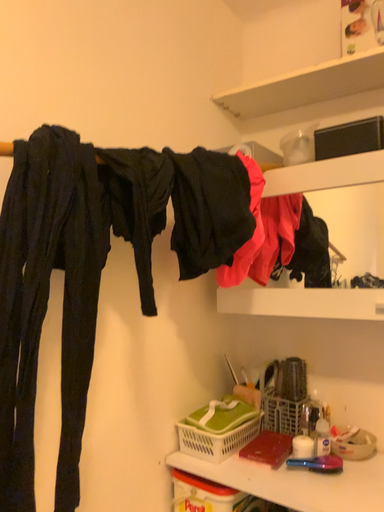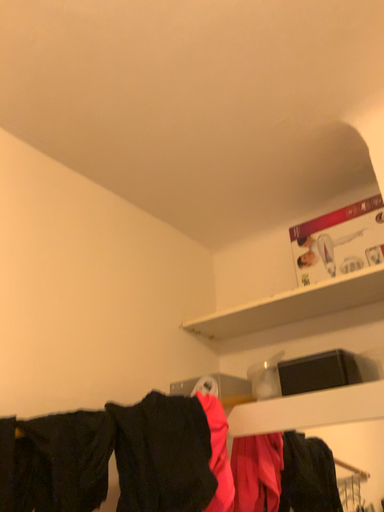
Question: How did the camera likely rotate when shooting the video?

Choices:
 (A) rotated upward
 (B) rotated downward

Answer: (A)